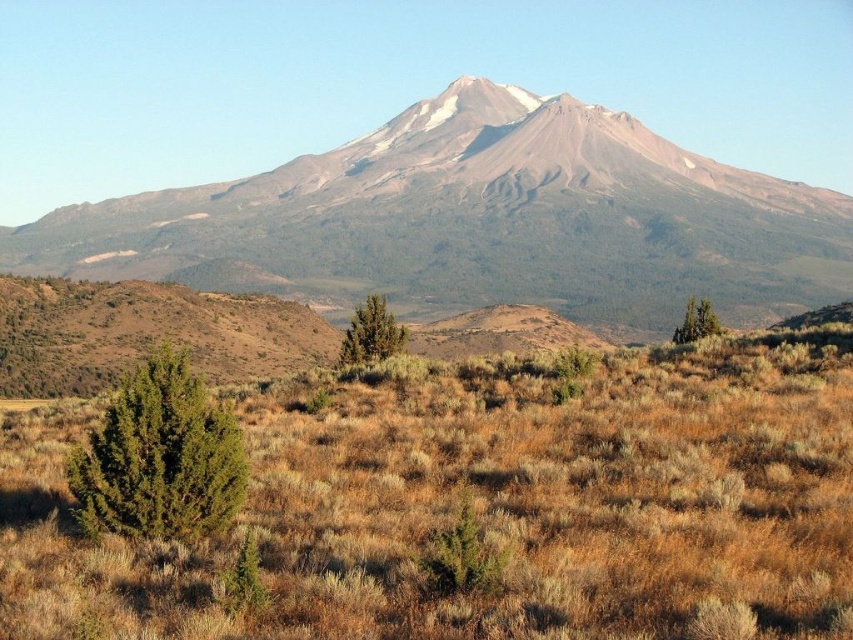
Question: Can you confirm if brown dry grass at center is positioned to the left of gray rocky mountain range at upper center?

Choices:
 (A) no
 (B) yes

Answer: (A)

Question: Considering the relative positions of green textured bush at lower left and green matte tree at center in the image provided, where is green textured bush at lower left located with respect to green matte tree at center?

Choices:
 (A) right
 (B) left

Answer: (B)

Question: Is gray rocky mountain range at upper center below green matte tree at center?

Choices:
 (A) no
 (B) yes

Answer: (A)

Question: Which point is farther to the camera?

Choices:
 (A) green textured bush at lower left
 (B) gray rocky mountain range at upper center
 (C) green matte tree at center-right
 (D) brown dry grass at center

Answer: (B)

Question: Which point is farther from the camera taking this photo?

Choices:
 (A) (268, 262)
 (B) (709, 332)
 (C) (102, 509)
 (D) (579, 522)

Answer: (A)

Question: Which is nearer to the brown dry grass at center?

Choices:
 (A) green matte tree at center-right
 (B) green matte tree at center

Answer: (B)